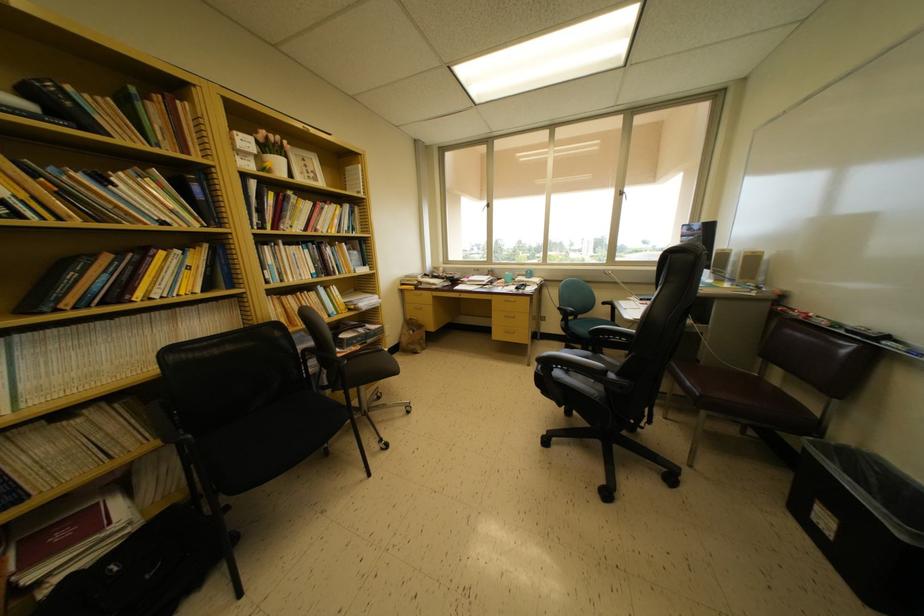
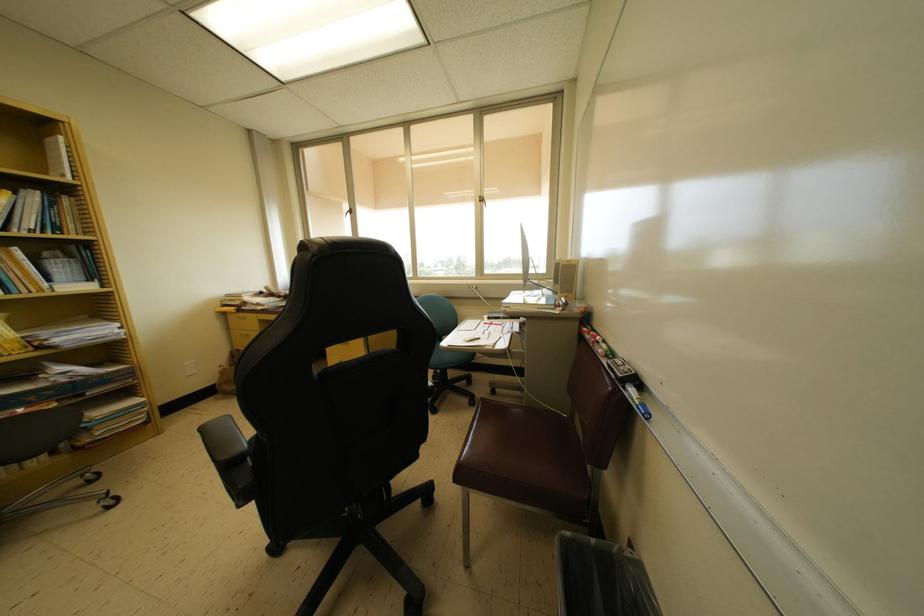
Locate, in the second image, the point that corresponds to pixel 344 265 in the first image.

(15, 278)